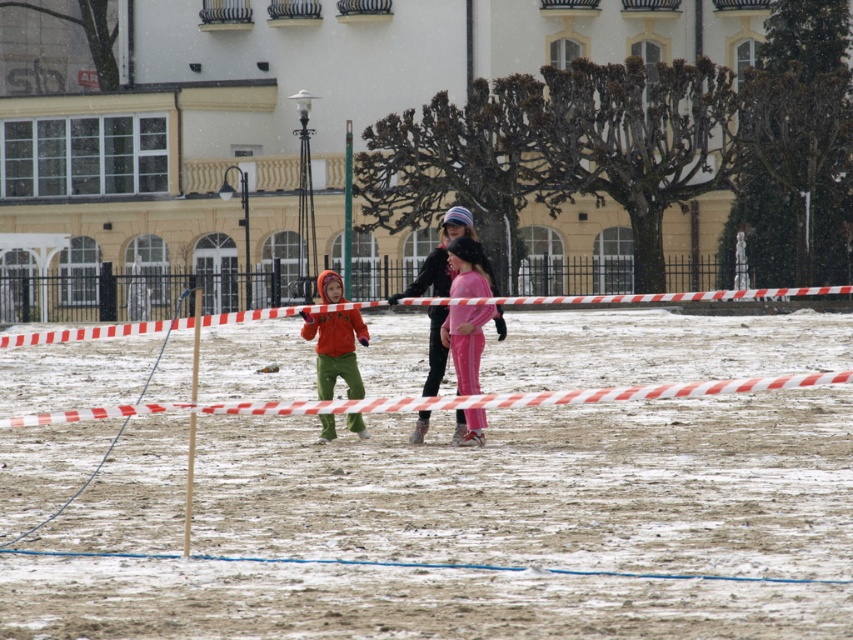
You are a parent trying to locate your child who is wearing pink fabric pants at center in the snowy square. The white plastic tape at center marks the boundary of the play area. From the tape, which direction should you walk to find your child?

The white plastic tape at center is to the left of the pink fabric pants at center, so you should walk to the right from the tape to find your child.

You are a parent trying to ensure your child stays within the play area marked by the white plastic tape at center. Your child is wearing pink fabric pants at center. Can the child see the tape from their current position?

The white plastic tape at center has a lesser height compared to pink fabric pants at center. Since the tape is lower than the child, they might be able to see over it, but visibility could depend on their exact position and how the tape is positioned relative to their line of sight.